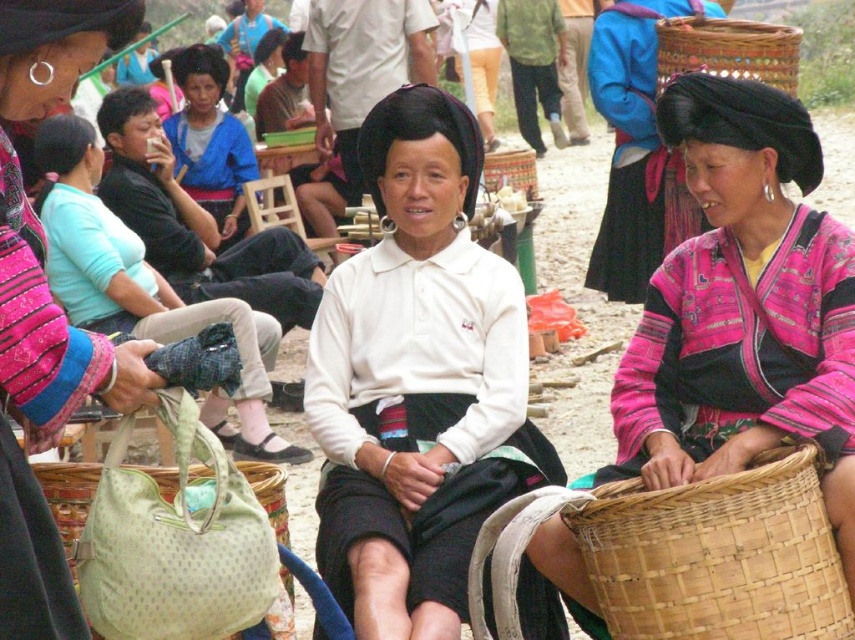
You are a customer at the market and want to pick up both the blue fabric shirt at center and the woven bamboo basket at center. Can you reach both items without moving from your current position?

The blue fabric shirt at center and woven bamboo basket at center are 19.89 feet apart, so you cannot reach both items without moving from your current position.

From the picture: You are a customer at this market and want to buy an item from the vendor. The vendor is wearing a blue fabric shirt at center and has a woven bamboo basket at center. Where is the vendor located relative to their basket?

The vendor wearing the blue fabric shirt at center is located above the woven bamboo basket at center, so the vendor is positioned higher than the basket.